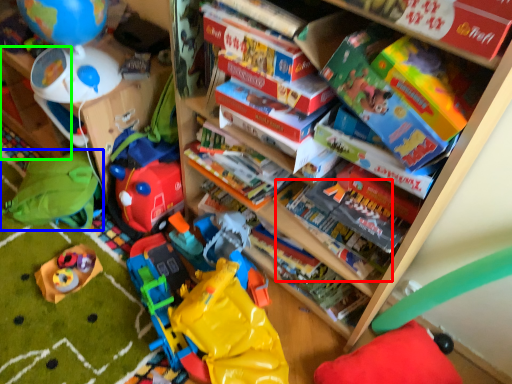
Question: Estimate the real-world distances between objects in this image. Which object is closer to book (highlighted by a red box), toy (highlighted by a blue box) or shelf (highlighted by a green box)?

Choices:
 (A) toy
 (B) shelf

Answer: (A)